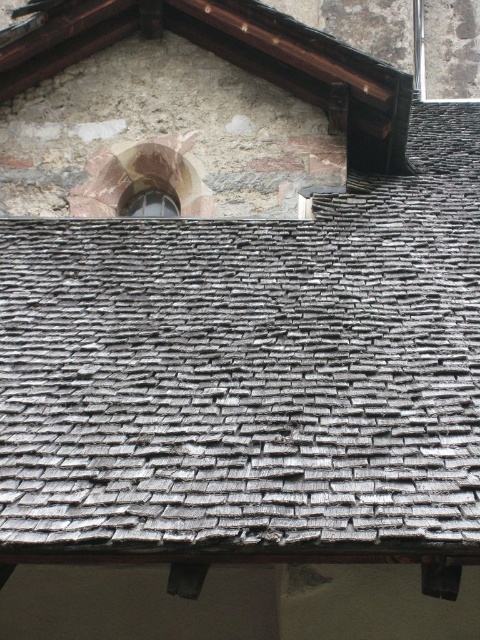
Question: Can you confirm if weathered wood shingles at upper center is positioned to the right of matte glass window at upper center?

Choices:
 (A) yes
 (B) no

Answer: (A)

Question: Which object is closer to the camera taking this photo?

Choices:
 (A) weathered wood shingles at upper center
 (B) matte glass window at upper center

Answer: (A)

Question: Can you confirm if weathered wood shingles at upper center is positioned above matte glass window at upper center?

Choices:
 (A) no
 (B) yes

Answer: (A)

Question: Does weathered wood shingles at upper center lie in front of matte glass window at upper center?

Choices:
 (A) no
 (B) yes

Answer: (B)

Question: Among these objects, which one is farthest from the camera?

Choices:
 (A) weathered wood shingles at upper center
 (B) matte glass window at upper center

Answer: (B)